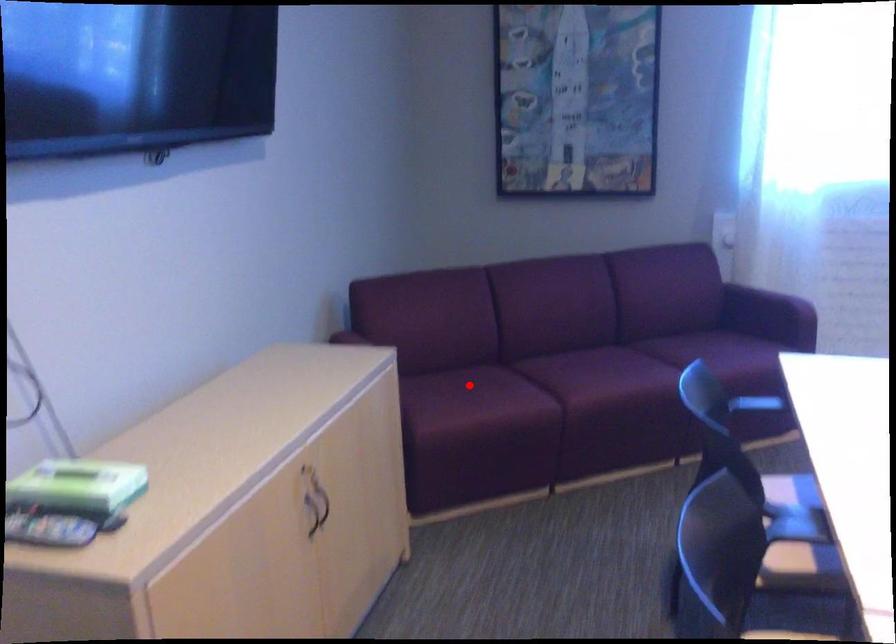
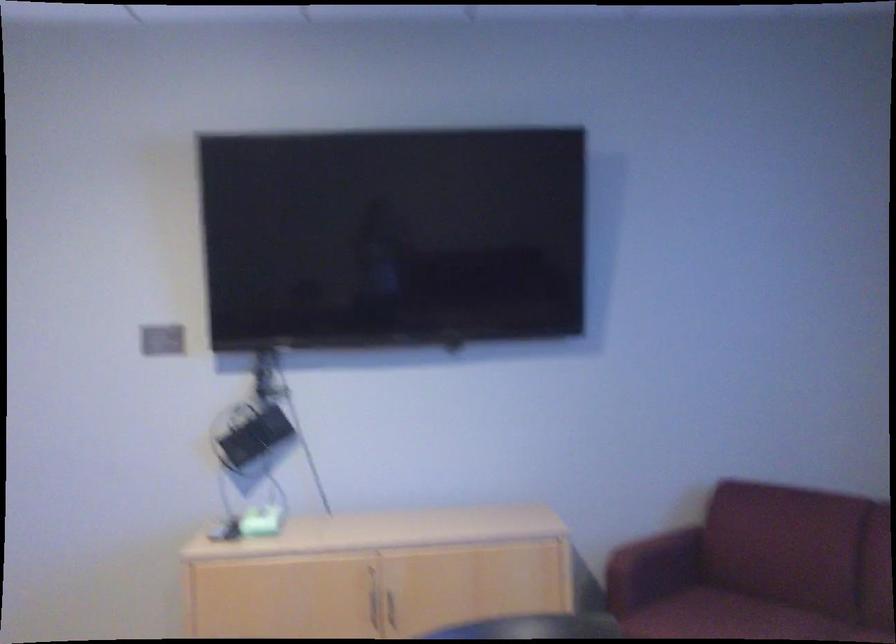
Where in the second image is the point corresponding to the highlighted location from the first image?

(722, 616)